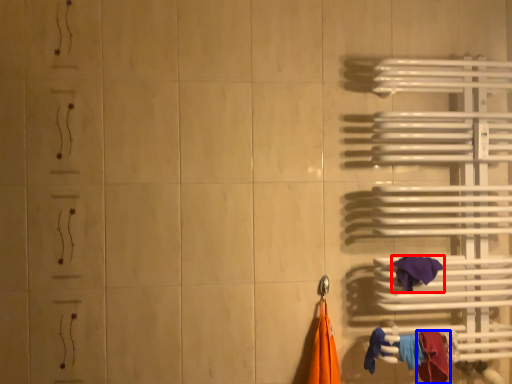
Question: Among these objects, which one is nearest to the camera, towel (highlighted by a red box) or towel (highlighted by a blue box)?

Choices:
 (A) towel
 (B) towel

Answer: (B)